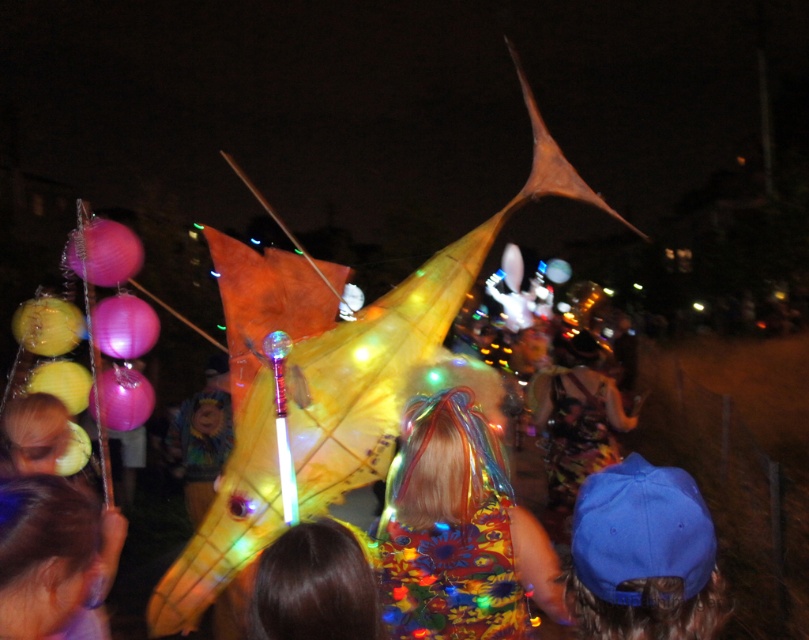
In the scene shown: You are a photographer trying to capture the best shot of the floral fabric dress at center and the brown hair at center during the festival. Since you want to highlight both subjects equally, which one should you zoom in on more to make them appear the same size in the photo?

The floral fabric dress at center is bigger than brown hair at center, so you should zoom in more on the brown hair at center to make them appear the same size in the photo.

You are a photographer at the festival and want to capture both the blue fabric cap at center and the floral dress at center in one shot. Which object should you focus on first to ensure both are in frame?

The blue fabric cap at center is located above the floral dress at center, so you should focus on the floral dress at center first to ensure both are in frame.